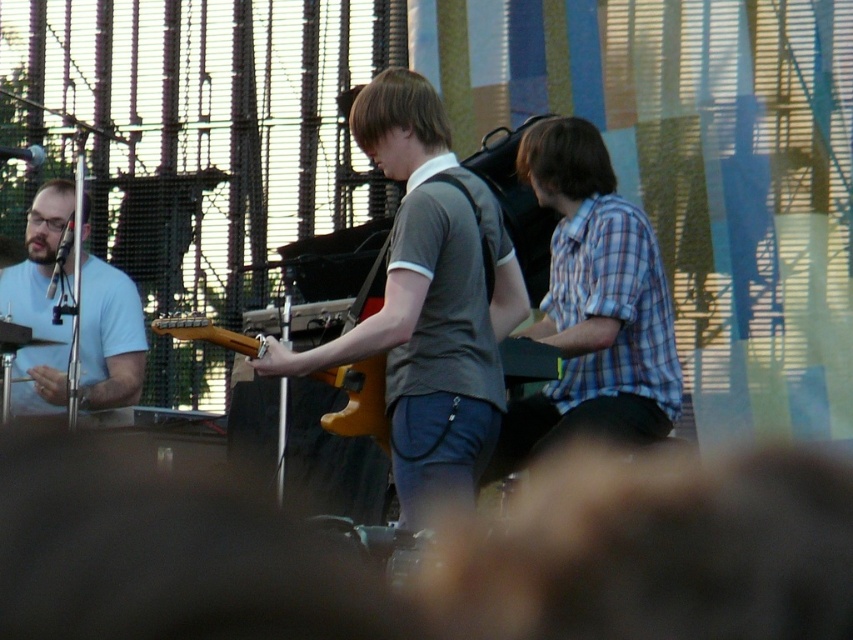
Based on the photo, you are a photographer at the concert and want to capture a photo of the keyboardist and the guitarist. You have two points marked on your camera screen to focus on. The first point is at coordinates point (616, 440) and the second is at point (251, 340). Which point should you focus on to ensure the keyboardist is in focus?

Point (251, 340) should be focused on to ensure the keyboardist is in focus because point (616, 440) is behind point (251, 340).

You are a photographer at the concert and want to capture the blue plaid shirt at center. Where should you aim your camera to ensure it is in the frame?

The blue plaid shirt at center is located at point (593, 305), so aim your camera at those coordinates to include it in the frame.

You are a photographer standing at the edge of the stage. You want to take a photo of both the blue plaid shirt at center and the light blue shirt at left. The camera you are using has a maximum focus range of 15 meters. Will both subjects be within the focus range?

The distance between the blue plaid shirt at center and the light blue shirt at left is 13.83 meters, which is within the camera maximum focus range of 15 meters. So both subjects will be within the focus range.